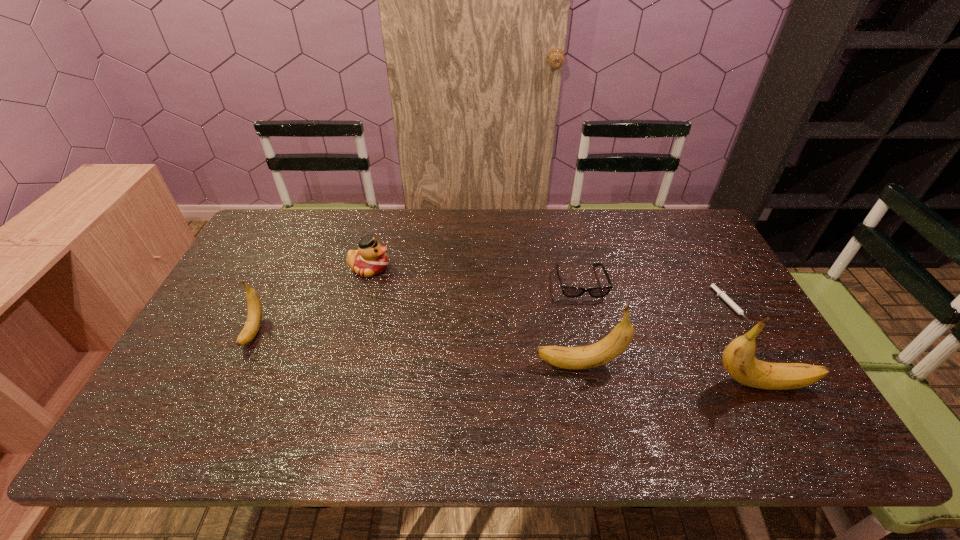
You are a GUI agent. You are given a task and a screenshot of the screen. Output one action in this format:
    pyautogui.click(x=<x>, y=<y>)
    Task: Click on the leftmost object
    The width and height of the screenshot is (960, 540).
    Given the screenshot: What is the action you would take?
    pyautogui.click(x=254, y=317)

You are a GUI agent. You are given a task and a screenshot of the screen. Output one action in this format:
    pyautogui.click(x=<x>, y=<y>)
    Task: Click on the shortest banana
    Image resolution: width=960 pixels, height=540 pixels.
    Given the screenshot: What is the action you would take?
    pyautogui.click(x=254, y=317)

Find the location of a particular element. Image resolution: width=960 pixels, height=540 pixels. the second tallest banana is located at coordinates (618, 340).

The image size is (960, 540). Find the location of `the fifth shortest object`. the fifth shortest object is located at coordinates (618, 340).

Locate an element on the screen. Image resolution: width=960 pixels, height=540 pixels. the rightmost banana is located at coordinates (738, 358).

The image size is (960, 540). Identify the location of duck. point(370,259).

Image resolution: width=960 pixels, height=540 pixels. In order to click on the third shortest object in this screenshot , I will do `click(370, 259)`.

At what (x,y) coordinates should I click in order to perform the action: click on the shortest object. Please return your answer as a coordinate pair (x, y). The height and width of the screenshot is (540, 960). Looking at the image, I should click on (732, 304).

At what (x,y) coordinates should I click in order to perform the action: click on spectacles. Please return your answer as a coordinate pair (x, y). Looking at the image, I should click on (572, 292).

Locate an element on the screen. This screenshot has width=960, height=540. free space located 0.090m at the start of the peel on the leftmost banana is located at coordinates (229, 383).